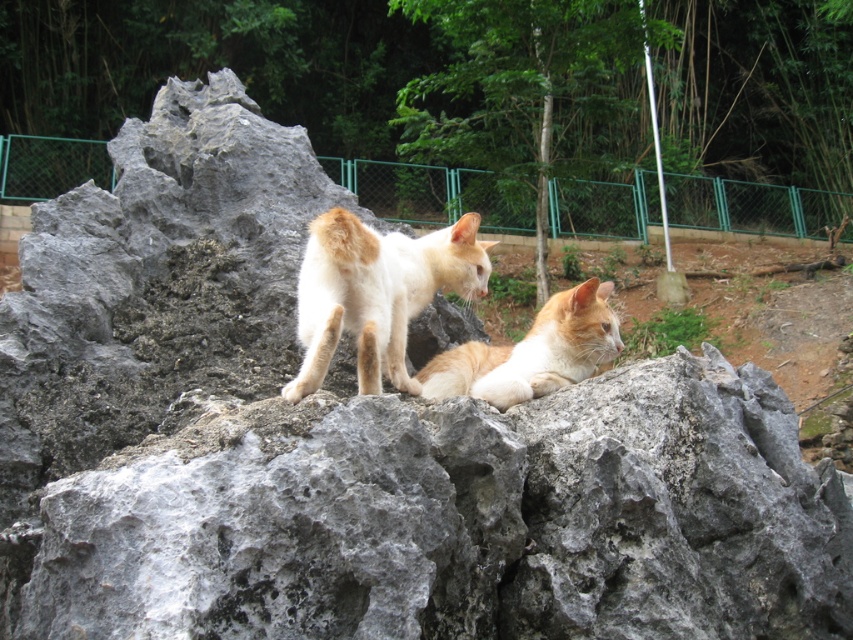
Question: Among these points, which one is farthest from the camera?

Choices:
 (A) (297, 332)
 (B) (558, 179)
 (C) (15, 156)

Answer: (C)

Question: Does green metal fence at upper center come behind white fur cat at center?

Choices:
 (A) yes
 (B) no

Answer: (A)

Question: Is green metal fence at upper center smaller than green wire mesh fence at center?

Choices:
 (A) no
 (B) yes

Answer: (B)

Question: Which object appears closest to the camera in this image?

Choices:
 (A) green metal fence at upper center
 (B) green wire mesh fence at center
 (C) orange fur cat at center
 (D) white fur cat at center

Answer: (D)

Question: Considering the real-world distances, which object is closest to the green wire mesh fence at center?

Choices:
 (A) white fur cat at center
 (B) orange fur cat at center
 (C) green metal fence at upper center

Answer: (C)

Question: Observing the image, what is the correct spatial positioning of green wire mesh fence at center in reference to white fur cat at center?

Choices:
 (A) above
 (B) below

Answer: (A)